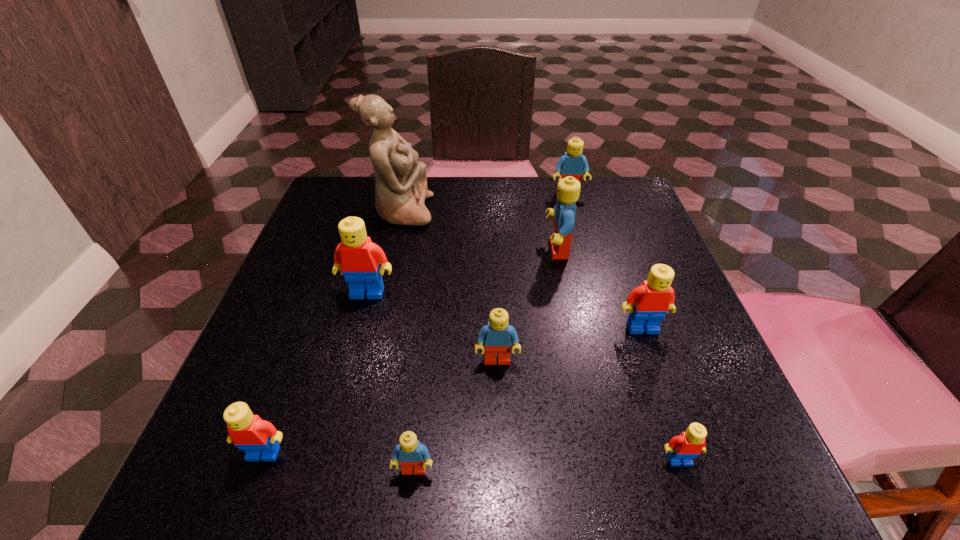
Where is `the second blue Lego from left to right`? The height and width of the screenshot is (540, 960). the second blue Lego from left to right is located at coordinates (497, 336).

Locate an element on the screen. the fifth Lego from right to left is located at coordinates pyautogui.click(x=497, y=336).

The image size is (960, 540). I want to click on the third biggest red Lego, so click(258, 438).

Locate an element on the screen. the smallest red Lego is located at coordinates click(682, 449).

I want to click on the smallest blue Lego, so click(411, 453).

Where is `the leftmost blue Lego`? the leftmost blue Lego is located at coordinates (411, 453).

Where is `free space located on the front-facing side of the figurine`? This screenshot has width=960, height=540. free space located on the front-facing side of the figurine is located at coordinates (469, 212).

Locate an element on the screen. Image resolution: width=960 pixels, height=540 pixels. blank space located on the face of the biggest blue Lego is located at coordinates (433, 249).

Where is `vacant space situated 0.050m on the face of the biggest blue Lego`? This screenshot has height=540, width=960. vacant space situated 0.050m on the face of the biggest blue Lego is located at coordinates (523, 249).

Image resolution: width=960 pixels, height=540 pixels. What are the coordinates of `free location located on the face of the biggest blue Lego` in the screenshot? It's located at pyautogui.click(x=371, y=249).